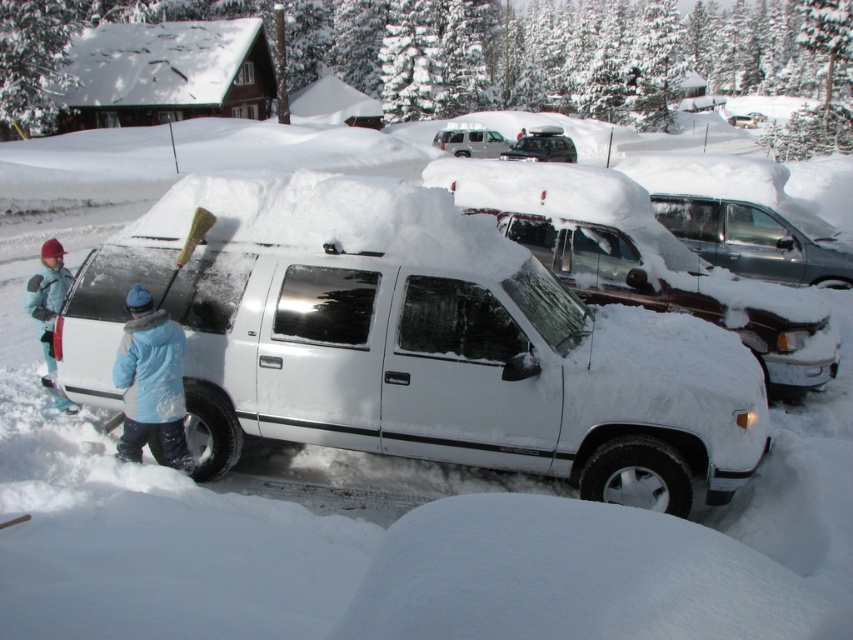
You are standing in the snowy parking lot and want to move the silver metallic suv at upper center out of the way. Can you drive it directly forward without hitting the matte black suv at center?

The silver metallic suv at upper center is closer to you than the matte black suv at center, so you can drive it forward without hitting the matte black suv at center because it is further away.

You are trying to decide which SUV to rent for a winter trip. Both the silver metallic suv at upper center and the matte black suv at center are available. Considering their sizes, which one would you choose if you need more space for luggage?

The silver metallic suv at upper center is bigger than the matte black suv at center, so you should choose the silver metallic suv at upper center for more space.